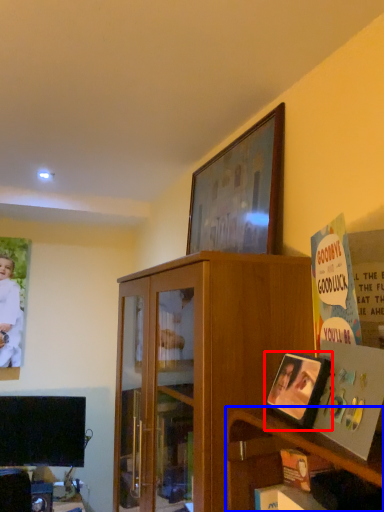
Question: Among these objects, which one is nearest to the camera, picture frame (highlighted by a red box) or shelf (highlighted by a blue box)?

Choices:
 (A) picture frame
 (B) shelf

Answer: (A)